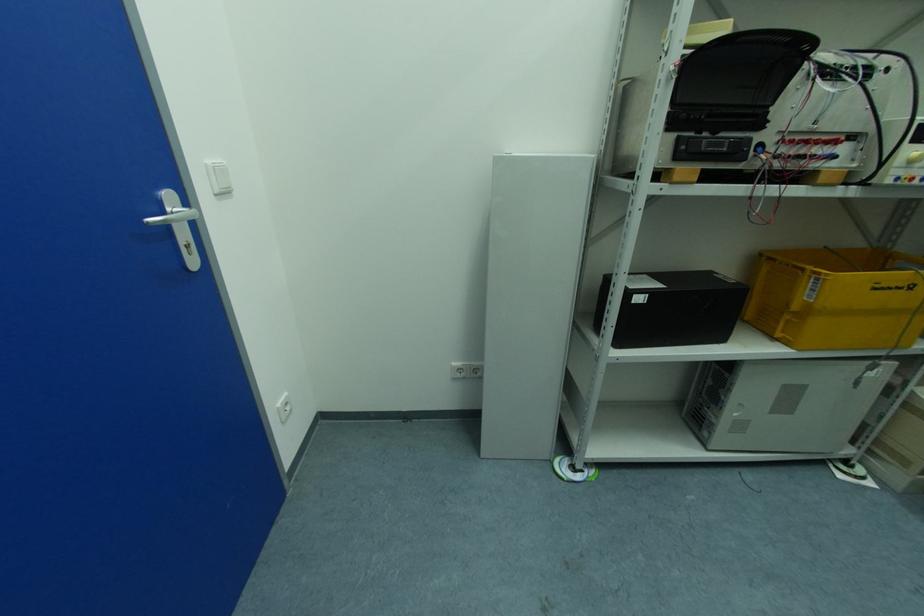
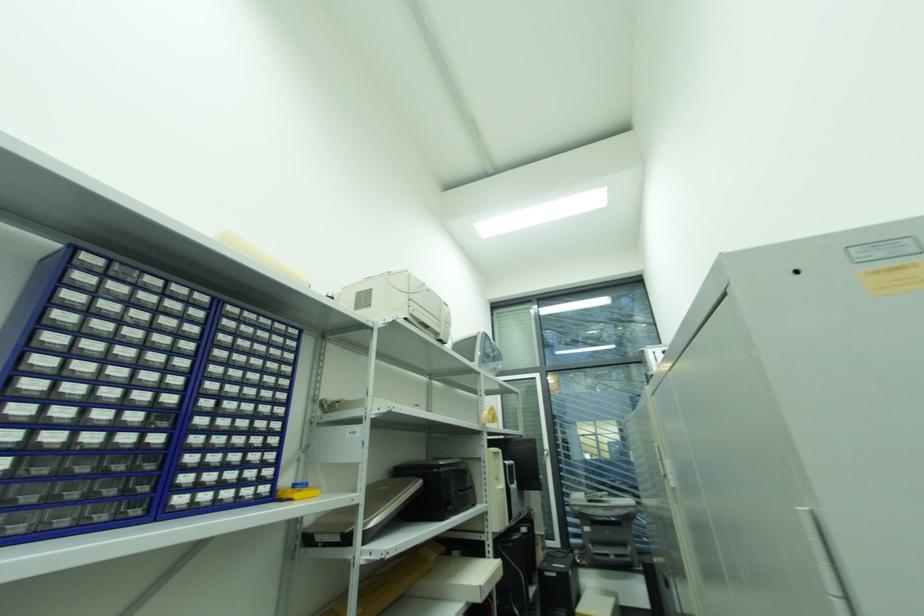
How did the camera likely rotate?

The camera rotated toward right-up.